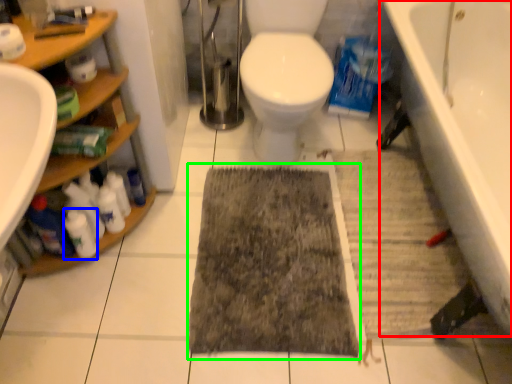
Question: Considering the real-world distances, which object is closest to bathtub (highlighted by a red box)? cleaning product (highlighted by a blue box) or doormat (highlighted by a green box).

Choices:
 (A) cleaning product
 (B) doormat

Answer: (B)